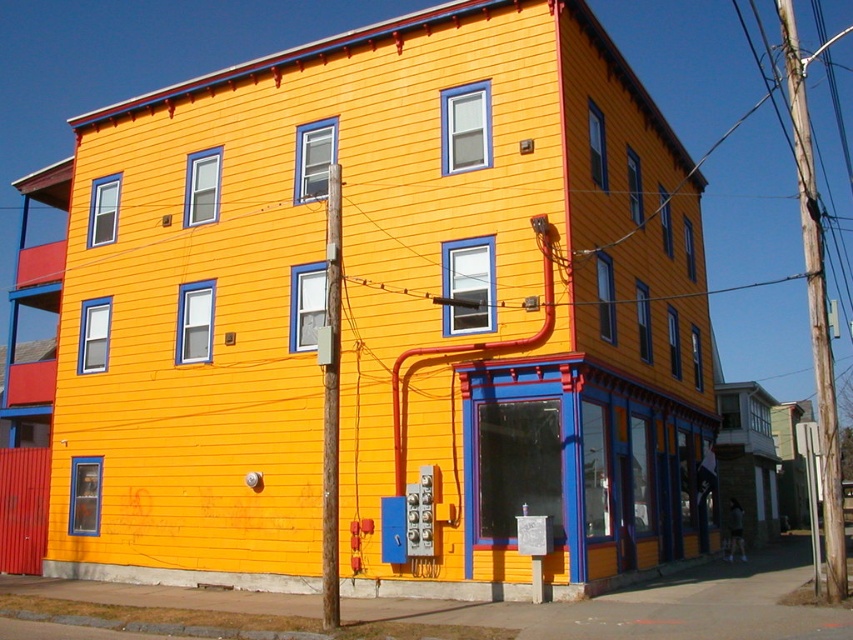
Question: Which point is closer to the camera?

Choices:
 (A) wooden utility pole at right
 (B) smooth wood pole at center

Answer: (B)

Question: Which point appears farthest from the camera in this image?

Choices:
 (A) (811, 291)
 (B) (334, 372)

Answer: (A)

Question: Is wooden utility pole at right behind smooth wood pole at center?

Choices:
 (A) no
 (B) yes

Answer: (B)

Question: Does wooden utility pole at right have a greater width compared to smooth wood pole at center?

Choices:
 (A) yes
 (B) no

Answer: (A)

Question: Is wooden utility pole at right bigger than smooth wood pole at center?

Choices:
 (A) no
 (B) yes

Answer: (B)

Question: Which of the following is the closest to the observer?

Choices:
 (A) (782, 38)
 (B) (323, 605)

Answer: (B)